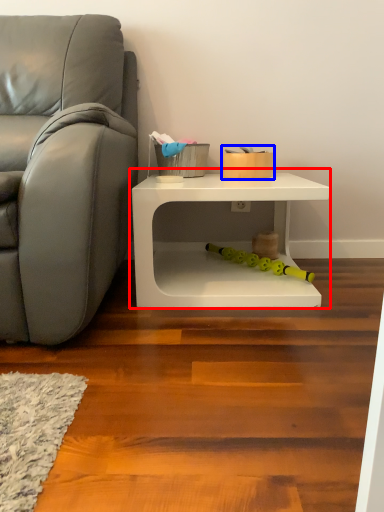
Question: Which object appears closest to the camera in this image, table (highlighted by a red box) or toy (highlighted by a blue box)?

Choices:
 (A) table
 (B) toy

Answer: (A)